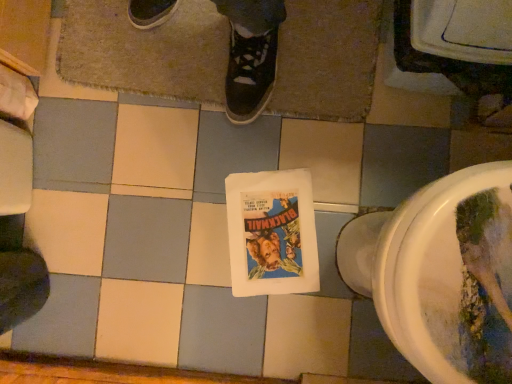
Locate an element on the screen. The width and height of the screenshot is (512, 384). vacant space that's between white glossy toilet at lower right and brown textured bath mat at upper center is located at coordinates (266, 187).